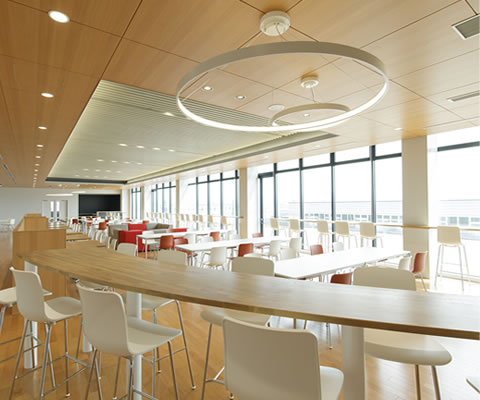
Locate an element on the screen. tables is located at coordinates (320, 261), (211, 244), (182, 234), (108, 223), (104, 219), (88, 217), (80, 217).